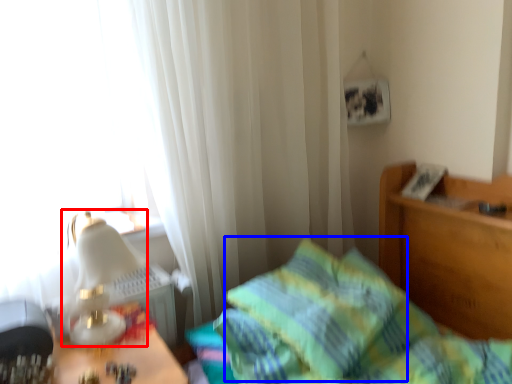
Question: Which object is further to the camera taking this photo, table lamp (highlighted by a red box) or pillow (highlighted by a blue box)?

Choices:
 (A) table lamp
 (B) pillow

Answer: (B)